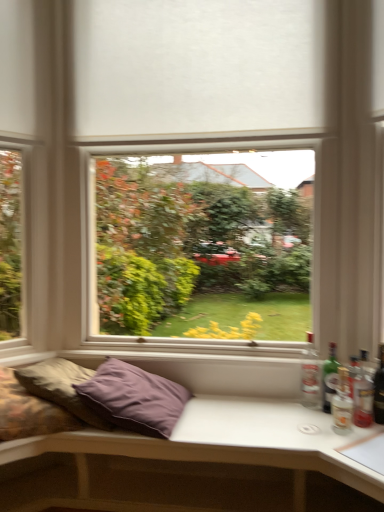
The width and height of the screenshot is (384, 512). In order to click on vacant space to the left of clear glass bottle at right, marked as the 1th bottle in a left-to-right arrangement in this screenshot , I will do `click(277, 406)`.